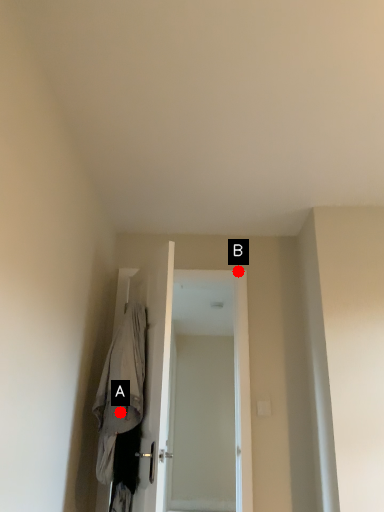
Question: Two points are circled on the image, labeled by A and B beside each circle. Which point is closer to the camera taking this photo?

Choices:
 (A) A is closer
 (B) B is closer

Answer: (A)